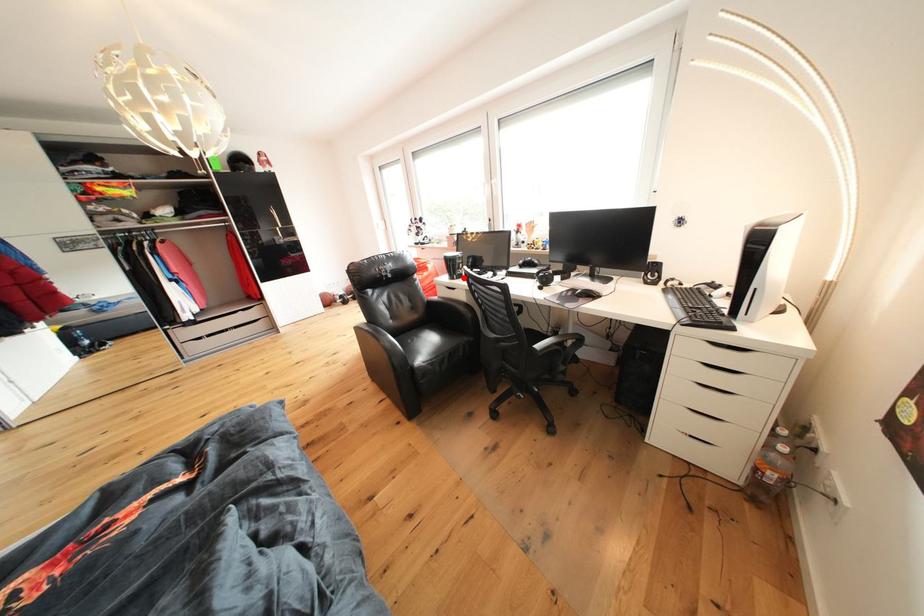
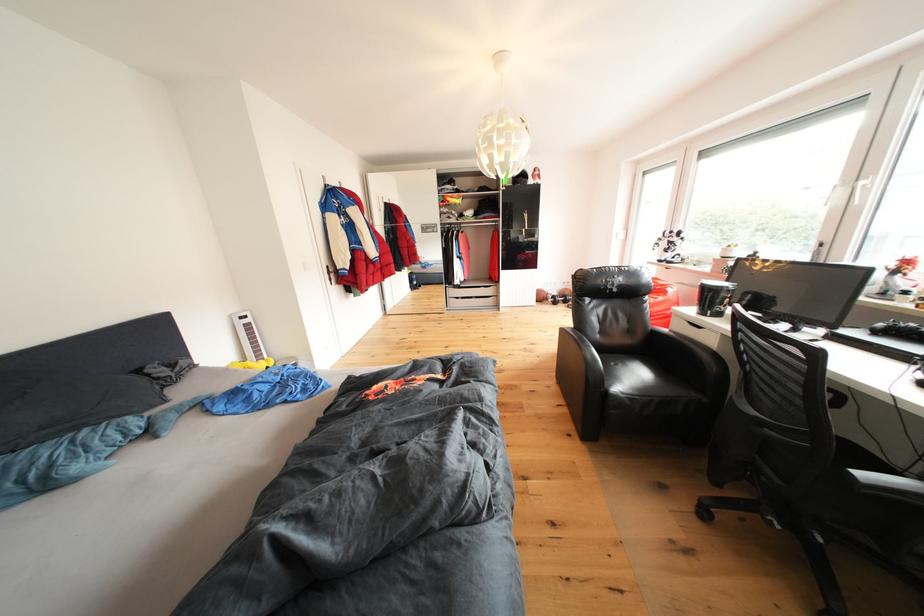
The point at the highlighted location is marked in the first image. Where is the corresponding point in the second image?

(720, 313)